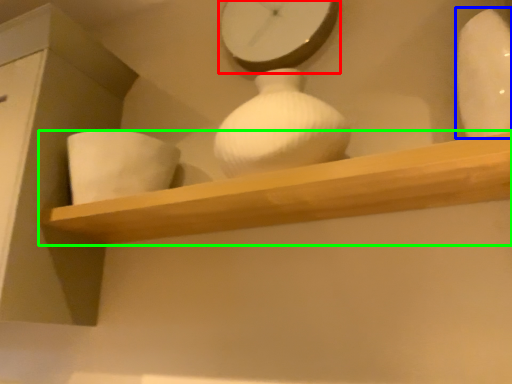
Question: Which is nearer to the clock (highlighted by a red box)? vase (highlighted by a blue box) or shelf (highlighted by a green box).

Choices:
 (A) vase
 (B) shelf

Answer: (A)